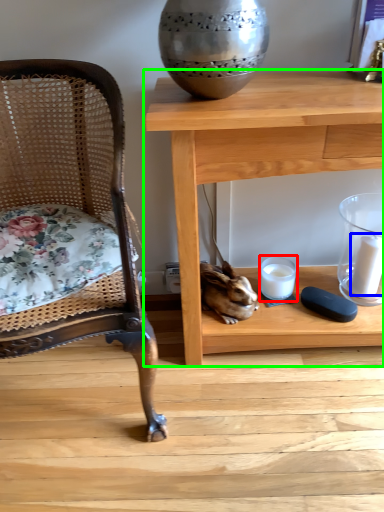
Question: Which is nearer to the candle holder (highlighted by a red box)? candle (highlighted by a blue box) or table (highlighted by a green box).

Choices:
 (A) candle
 (B) table

Answer: (A)